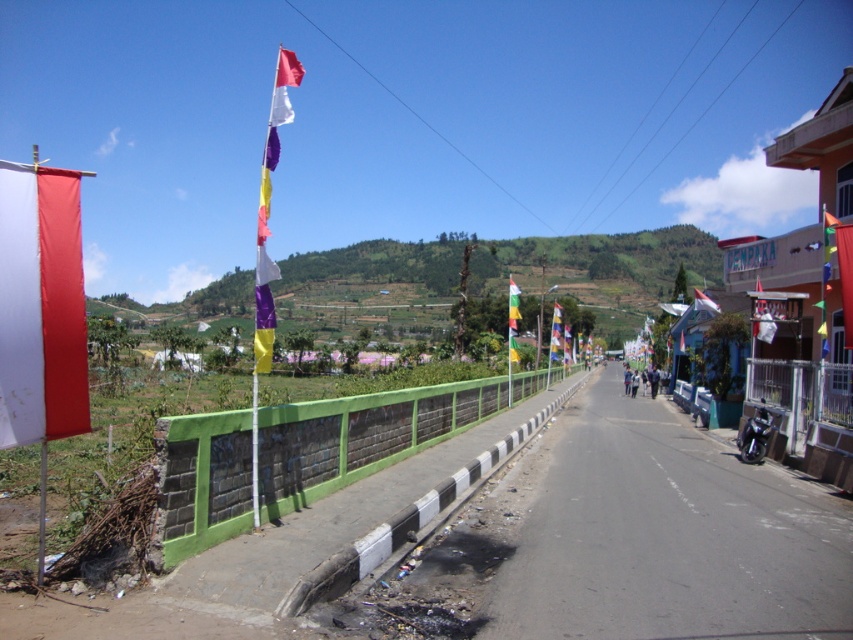
Question: Estimate the real-world distances between objects in this image. Which object is farther from the multicolored fabric flag at center?

Choices:
 (A) green painted brick wall at center
 (B) yellow fabric flag at center
 (C) white fabric flag at center
 (D) white fabric flag at left

Answer: (D)

Question: Can you confirm if white fabric flag at left is positioned above white fabric flag at center?

Choices:
 (A) yes
 (B) no

Answer: (B)

Question: Which of the following is the closest to the observer?

Choices:
 (A) white fabric flag at center
 (B) yellow-green fabric flag at center
 (C) matte fabric flag at center

Answer: (C)

Question: Which point is closer to the camera?

Choices:
 (A) (564, 333)
 (B) (695, 291)
 (C) (74, 353)

Answer: (C)

Question: Is white fabric flag at left in front of yellow fabric flag at center?

Choices:
 (A) no
 (B) yes

Answer: (B)

Question: Is green painted brick wall at center smaller than yellow fabric flag at center?

Choices:
 (A) no
 (B) yes

Answer: (A)